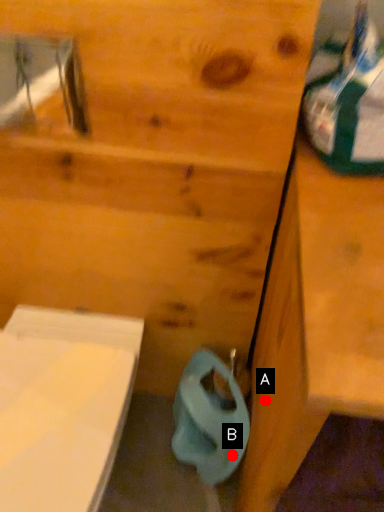
Question: Two points are circled on the image, labeled by A and B beside each circle. Which point is farther to the camera?

Choices:
 (A) A is further
 (B) B is further

Answer: (B)